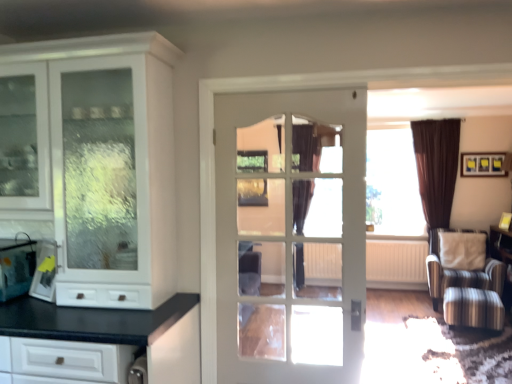
Question: Is the position of yellow plastic bag at left, placed as the first appliance when sorted from right to left, more distant than that of black velvet curtain at center?

Choices:
 (A) yes
 (B) no

Answer: (B)

Question: Is yellow plastic bag at left, placed as the first appliance when sorted from right to left, facing away from black velvet curtain at center?

Choices:
 (A) yes
 (B) no

Answer: (A)

Question: Is yellow plastic bag at left, the second appliance positioned from the left, wider than black velvet curtain at center?

Choices:
 (A) yes
 (B) no

Answer: (B)

Question: Is yellow plastic bag at left, the second appliance positioned from the left, smaller than black velvet curtain at center?

Choices:
 (A) no
 (B) yes

Answer: (B)

Question: Considering the relative sizes of yellow plastic bag at left, placed as the first appliance when sorted from right to left, and black velvet curtain at center in the image provided, is yellow plastic bag at left, placed as the first appliance when sorted from right to left, thinner than black velvet curtain at center?

Choices:
 (A) no
 (B) yes

Answer: (B)

Question: Does yellow plastic bag at left, the second appliance positioned from the left, contain black velvet curtain at center?

Choices:
 (A) yes
 (B) no

Answer: (B)

Question: Considering the relative sizes of white glossy cabinet at left and metallic silver bag at left, arranged as the 1th appliance when viewed from the left, in the image provided, is white glossy cabinet at left shorter than metallic silver bag at left, arranged as the 1th appliance when viewed from the left,?

Choices:
 (A) yes
 (B) no

Answer: (B)

Question: Considering the relative positions of white glossy cabinet at left and metallic silver bag at left, arranged as the 1th appliance when viewed from the left, in the image provided, is white glossy cabinet at left to the right of metallic silver bag at left, arranged as the 1th appliance when viewed from the left, from the viewer's perspective?

Choices:
 (A) no
 (B) yes

Answer: (B)

Question: Is white glossy cabinet at left at the left side of metallic silver bag at left, the 2th appliance from the right?

Choices:
 (A) no
 (B) yes

Answer: (A)

Question: Is metallic silver bag at left, the 2th appliance from the right, at the back of white glossy cabinet at left?

Choices:
 (A) yes
 (B) no

Answer: (A)

Question: Is white glossy cabinet at left not near metallic silver bag at left, the 2th appliance from the right?

Choices:
 (A) no
 (B) yes

Answer: (A)

Question: Can you confirm if white glossy cabinet at left is thinner than metallic silver bag at left, the 2th appliance from the right?

Choices:
 (A) no
 (B) yes

Answer: (A)

Question: Is black velvet curtain at center closer to camera compared to white textured radiator at center?

Choices:
 (A) no
 (B) yes

Answer: (A)